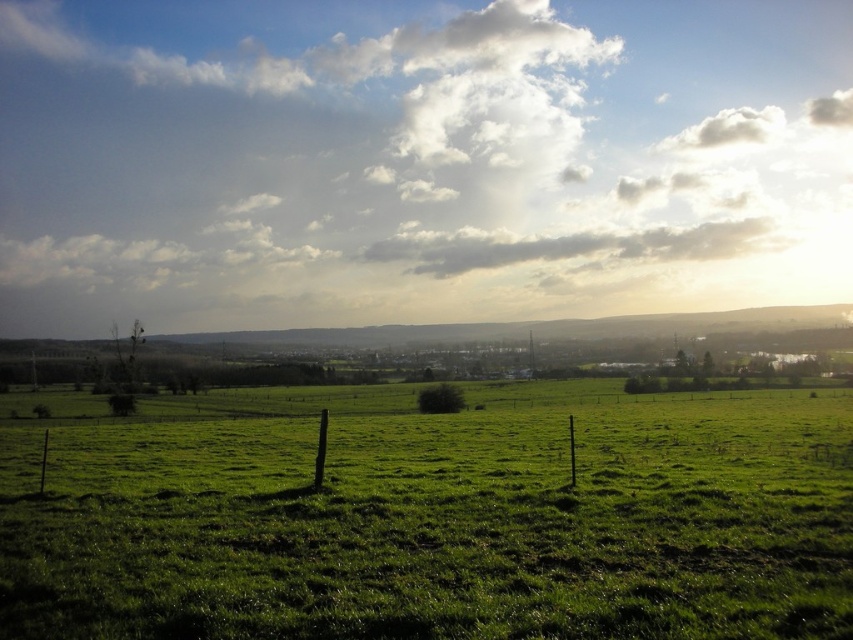
Question: Does white fluffy cloud at upper center have a greater width compared to green grassy field at center?

Choices:
 (A) no
 (B) yes

Answer: (B)

Question: Which point is closer to the camera?

Choices:
 (A) (207, 128)
 (B) (30, 403)

Answer: (B)

Question: Among these points, which one is nearest to the camera?

Choices:
 (A) (450, 12)
 (B) (222, 616)

Answer: (B)

Question: Does white fluffy cloud at upper center lie in front of green grassy field at center?

Choices:
 (A) yes
 (B) no

Answer: (B)

Question: Can you confirm if white fluffy cloud at upper center is positioned above green grassy field at center?

Choices:
 (A) no
 (B) yes

Answer: (B)